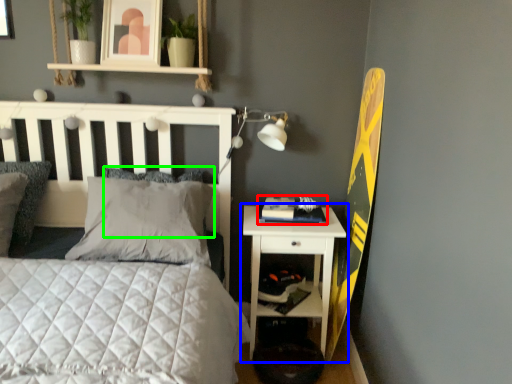
Question: Which object is positioned farthest from book (highlighted by a red box)? Select from nightstand (highlighted by a blue box) and pillow (highlighted by a green box).

Choices:
 (A) nightstand
 (B) pillow

Answer: (B)